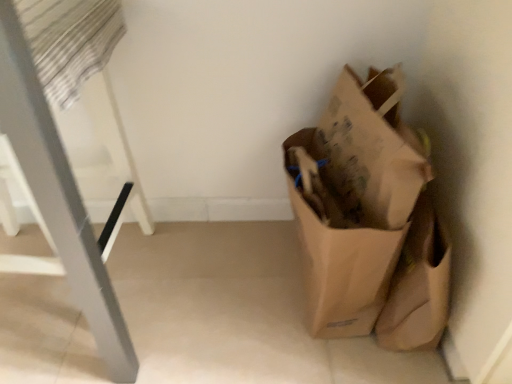
Question: Does point (385, 81) appear closer or farther from the camera than point (103, 268)?

Choices:
 (A) farther
 (B) closer

Answer: (A)

Question: Considering the positions of brown paper bag at right and metallic silver ladder at left in the image, is brown paper bag at right bigger or smaller than metallic silver ladder at left?

Choices:
 (A) big
 (B) small

Answer: (B)

Question: Considering their positions, is brown paper bag at right located in front of or behind metallic silver ladder at left?

Choices:
 (A) behind
 (B) front

Answer: (A)

Question: Does point (9, 39) appear closer or farther from the camera than point (322, 256)?

Choices:
 (A) closer
 (B) farther

Answer: (A)

Question: From a real-world perspective, is metallic silver ladder at left physically located above or below brown paper bag at right?

Choices:
 (A) above
 (B) below

Answer: (A)

Question: Relative to brown paper bag at right, is metallic silver ladder at left in front or behind?

Choices:
 (A) front
 (B) behind

Answer: (A)

Question: From the image's perspective, relative to brown paper bag at right, is metallic silver ladder at left above or below?

Choices:
 (A) below
 (B) above

Answer: (B)